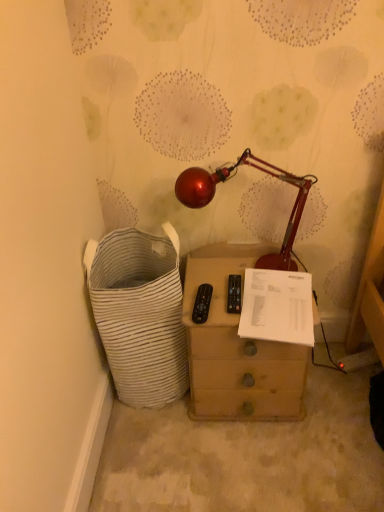
Locate an element on the screen. The width and height of the screenshot is (384, 512). free space in front of wooden chest of drawers at center is located at coordinates (256, 466).